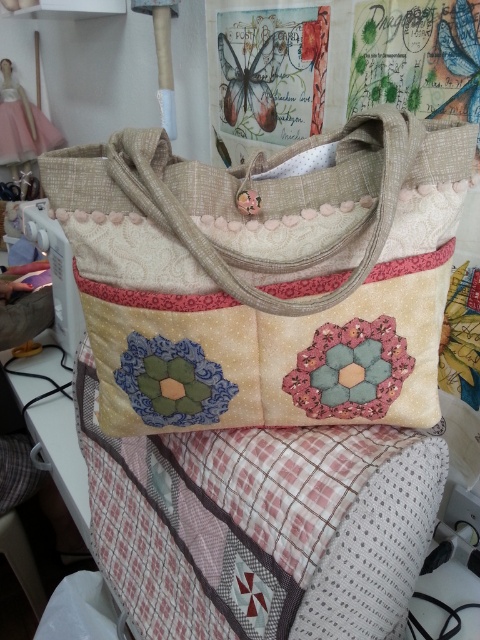
You are a tailor working in a small workshop. You have a sewing machine with limited space between the patchwork fabric quilt at center and the textured beige shoulder bag at center. Can you fit a 30 cm long ruler between them?

The distance between the patchwork fabric quilt at center and the textured beige shoulder bag at center is 29.15 centimeters, which is shorter than the 30 cm ruler. Therefore, the ruler cannot fit between them.

You are organizing a craft fair booth and need to display both the patchwork fabric quilt at center and the textured beige shoulder bag at center on a shelf. If the shelf has limited space, which item should you place first to ensure both fit?

The textured beige shoulder bag at center should be placed first because the patchwork fabric quilt at center is larger and requires more space, allowing both items to fit on the shelf.

Based on the photo, you are a tailor working on a sewing project. You have a patchwork fabric quilt at center and a textured beige shoulder bag at center. Which object is taller in the image?

The patchwork fabric quilt at center is much taller than the textured beige shoulder bag at center.